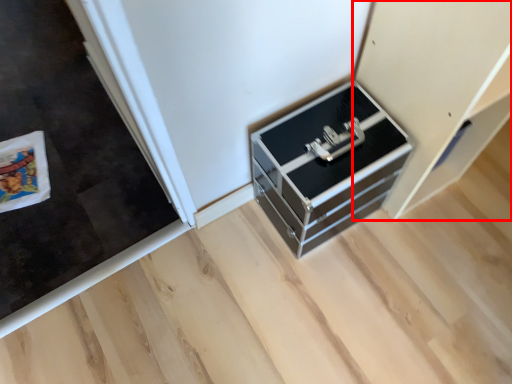
Question: Observing the image, what is the correct spatial positioning of cabinetry (annotated by the red box) in reference to chest of drawers?

Choices:
 (A) left
 (B) right

Answer: (B)